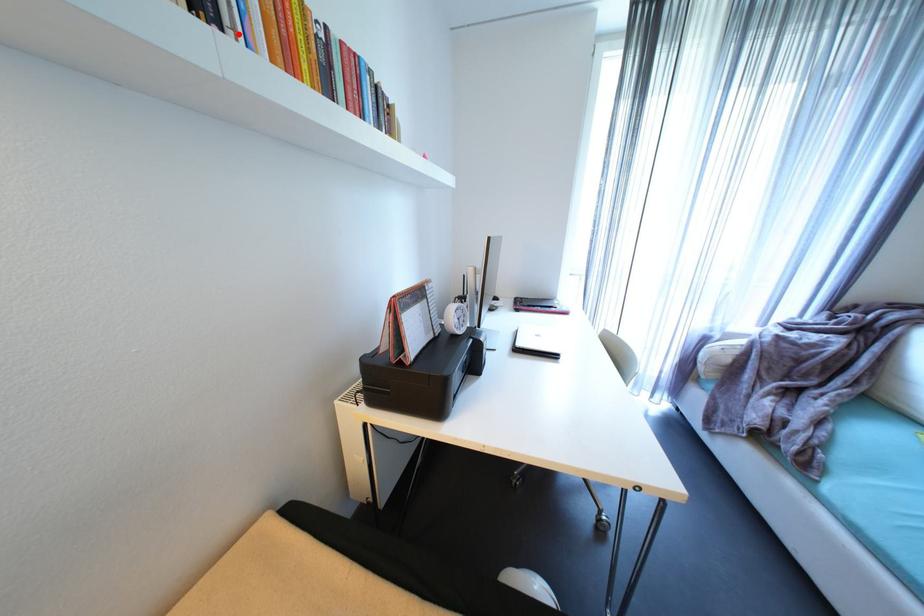
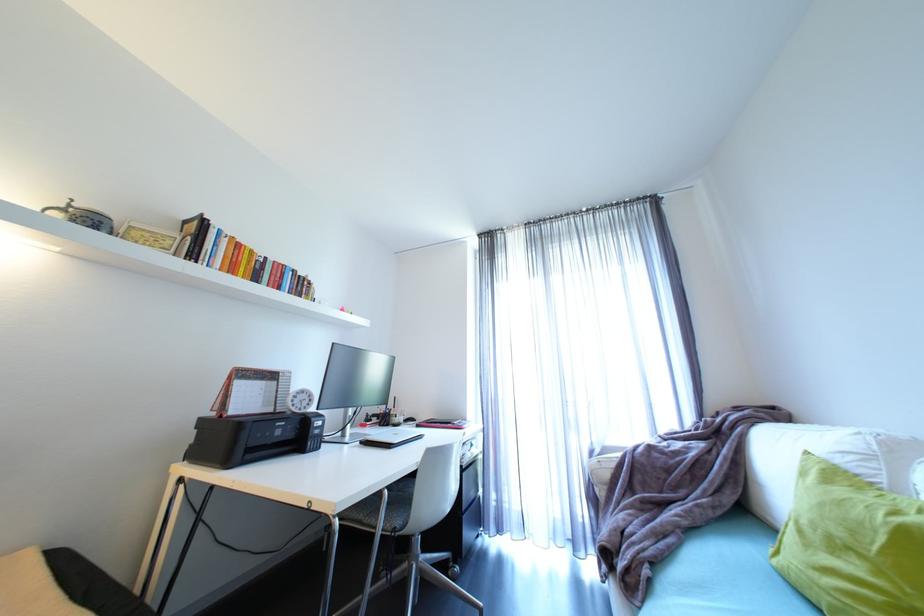
Where in the second image is the point corresponding to the highlighted location from the first image?

(208, 262)